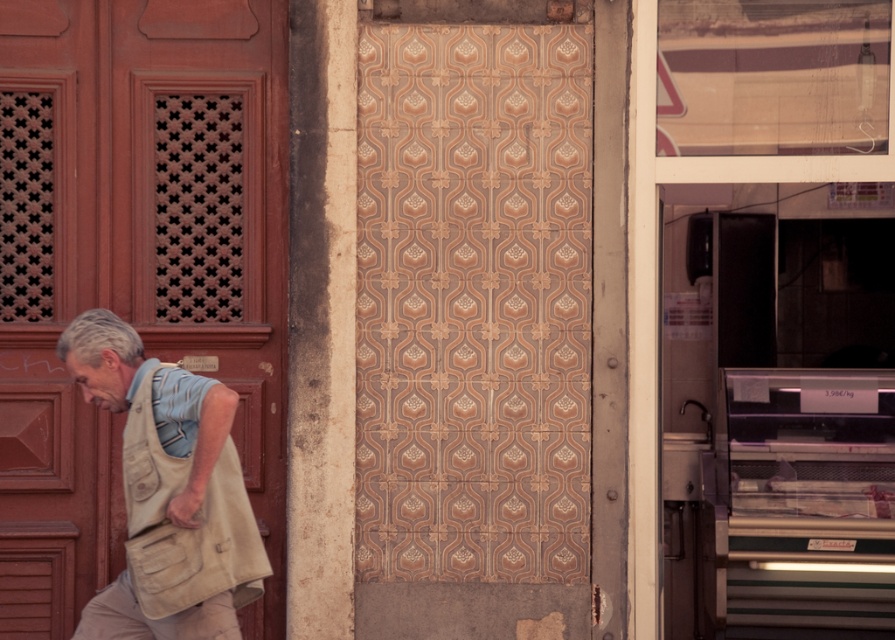
Is matte red door at center further to camera compared to beige canvas bag at left?

Yes, matte red door at center is behind beige canvas bag at left.

Is matte red door at center wider than beige canvas bag at left?

Correct, the width of matte red door at center exceeds that of beige canvas bag at left.

Where is `matte red door at center`? matte red door at center is located at coordinates (134, 264).